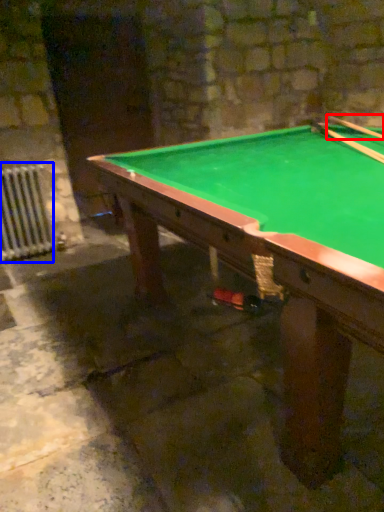
Question: Which of the following is the farthest to the observer, cue (highlighted by a red box) or radiator (highlighted by a blue box)?

Choices:
 (A) cue
 (B) radiator

Answer: (B)